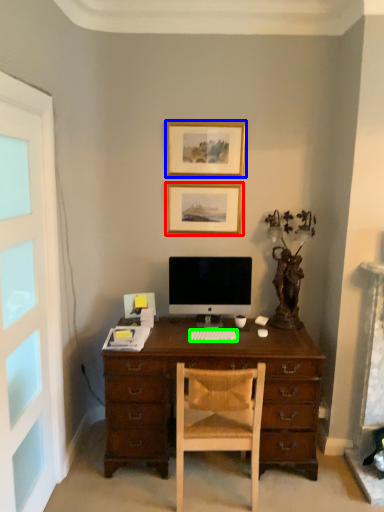
Question: Which is farther away from picture frame (highlighted by a red box)? picture frame (highlighted by a blue box) or computer keyboard (highlighted by a green box)?

Choices:
 (A) picture frame
 (B) computer keyboard

Answer: (B)